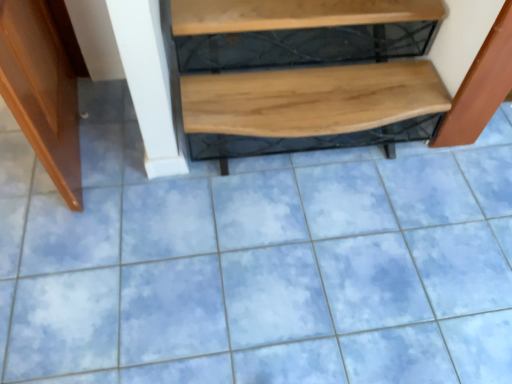
Question: Considering the relative positions of natural wood bench at center and wooden at upper center in the image provided, is natural wood bench at center to the right of wooden at upper center from the viewer's perspective?

Choices:
 (A) yes
 (B) no

Answer: (A)

Question: Would you say natural wood bench at center is outside wooden at upper center?

Choices:
 (A) no
 (B) yes

Answer: (B)

Question: Can you confirm if natural wood bench at center is smaller than wooden at upper center?

Choices:
 (A) no
 (B) yes

Answer: (A)

Question: Is natural wood bench at center taller than wooden at upper center?

Choices:
 (A) no
 (B) yes

Answer: (B)

Question: Is natural wood bench at center to the left of wooden at upper center from the viewer's perspective?

Choices:
 (A) yes
 (B) no

Answer: (B)

Question: Can you confirm if natural wood bench at center is thinner than wooden at upper center?

Choices:
 (A) no
 (B) yes

Answer: (A)

Question: Is wooden bench at right taller than wooden at upper center?

Choices:
 (A) no
 (B) yes

Answer: (B)

Question: Is wooden bench at right shorter than wooden at upper center?

Choices:
 (A) no
 (B) yes

Answer: (A)

Question: Is wooden bench at right thinner than wooden at upper center?

Choices:
 (A) yes
 (B) no

Answer: (A)

Question: From the image's perspective, does wooden bench at right appear lower than wooden at upper center?

Choices:
 (A) no
 (B) yes

Answer: (B)

Question: Could you tell me if wooden bench at right is facing wooden at upper center?

Choices:
 (A) yes
 (B) no

Answer: (B)

Question: Is wooden bench at right wider than wooden at upper center?

Choices:
 (A) no
 (B) yes

Answer: (A)

Question: Can you confirm if wooden bench at right is positioned to the right of natural wood bench at center?

Choices:
 (A) no
 (B) yes

Answer: (B)